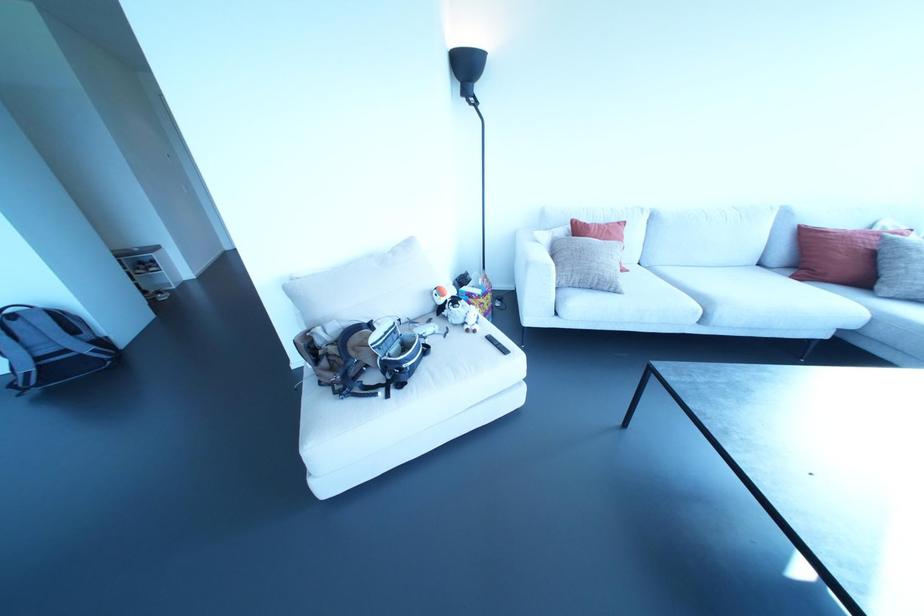
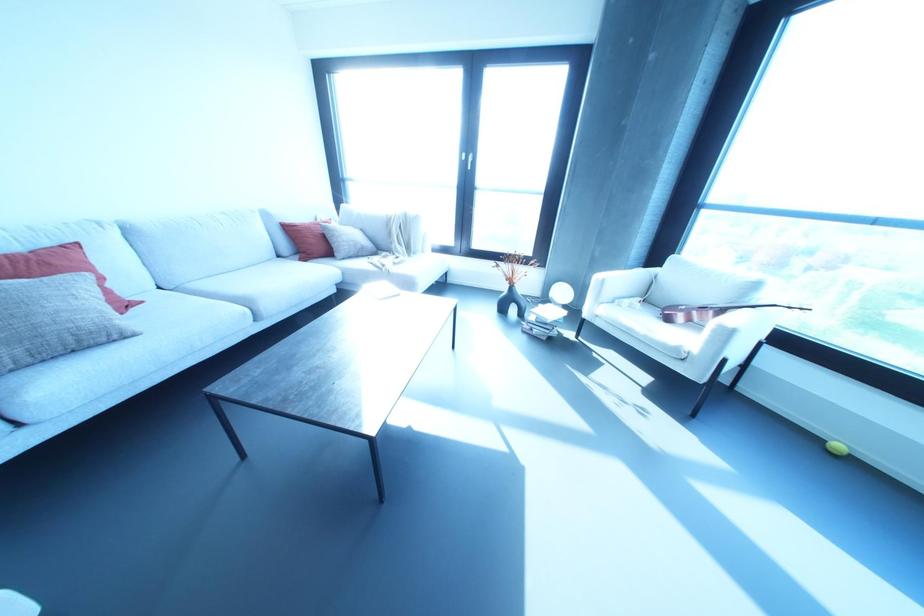
The images are taken continuously from a first-person perspective. In which direction is your viewpoint rotating?

The camera's rotation is toward right-down.